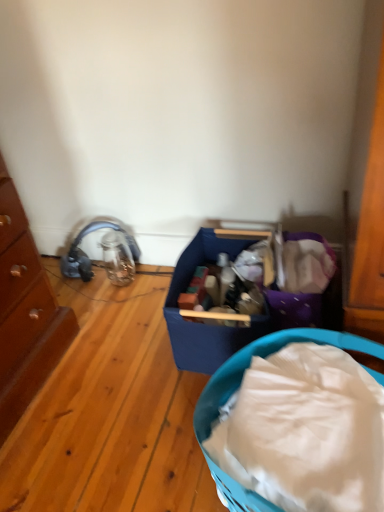
What is the approximate height of blue plastic basket at center?

blue plastic basket at center is 37.90 centimeters tall.

The width and height of the screenshot is (384, 512). Describe the element at coordinates (263, 357) in the screenshot. I see `blue plastic basket at center` at that location.

Locate an element on the screen. blue plastic basket at center is located at coordinates [263, 357].

Describe the element at coordinates (25, 313) in the screenshot. I see `wooden chest of drawers at left` at that location.

I want to click on wooden chest of drawers at left, so click(25, 313).

This screenshot has height=512, width=384. What are the coordinates of `blue plastic basket at center` in the screenshot? It's located at (263, 357).

Considering the relative positions of blue plastic basket at center and wooden chest of drawers at left in the image provided, is blue plastic basket at center to the left or to the right of wooden chest of drawers at left?

Based on their positions, blue plastic basket at center is located to the right of wooden chest of drawers at left.

Who is more distant, blue plastic basket at center or wooden chest of drawers at left?

wooden chest of drawers at left.

Which point is more distant from viewer, (x=219, y=494) or (x=11, y=276)?

The point (x=11, y=276) is farther.

From the image's perspective, between blue plastic basket at center and wooden chest of drawers at left, who is located below?

blue plastic basket at center is shown below in the image.

From a real-world perspective, which is physically below, blue plastic basket at center or wooden chest of drawers at left?

blue plastic basket at center is physically lower.

Considering the relative sizes of blue plastic basket at center and wooden chest of drawers at left in the image provided, is blue plastic basket at center thinner than wooden chest of drawers at left?

In fact, blue plastic basket at center might be wider than wooden chest of drawers at left.

Who is taller, blue plastic basket at center or wooden chest of drawers at left?

wooden chest of drawers at left is taller.

Which of these two, blue plastic basket at center or wooden chest of drawers at left, is bigger?

wooden chest of drawers at left is bigger.

Would you say blue plastic basket at center is inside or outside wooden chest of drawers at left?

The correct answer is: outside.

Looking at this image, is blue plastic basket at center far from wooden chest of drawers at left?

No.

Is blue plastic basket at center facing towards wooden chest of drawers at left?

No, blue plastic basket at center does not turn towards wooden chest of drawers at left.

From the picture: How far apart are blue plastic basket at center and wooden chest of drawers at left?

blue plastic basket at center and wooden chest of drawers at left are 25.42 inches apart.

Locate an element on the screen. The width and height of the screenshot is (384, 512). basket container below the wooden chest of drawers at left (from the image's perspective) is located at coordinates (263, 357).

Is wooden chest of drawers at left at the right side of blue plastic basket at center?

In fact, wooden chest of drawers at left is to the left of blue plastic basket at center.

Is wooden chest of drawers at left behind blue plastic basket at center?

Yes.

Between point (3, 349) and point (216, 375), which one is positioned in front?

The point (216, 375) is closer to the camera.

In the scene shown: From the image's perspective, between wooden chest of drawers at left and blue plastic basket at center, which one is located above?

wooden chest of drawers at left appears higher in the image.

From a real-world perspective, which object rests below the other?

blue plastic basket at center is physically lower.

Which of these two, wooden chest of drawers at left or blue plastic basket at center, is wider?

blue plastic basket at center is wider.

Between wooden chest of drawers at left and blue plastic basket at center, which one has more height?

wooden chest of drawers at left is taller.

In terms of size, does wooden chest of drawers at left appear bigger or smaller than blue plastic basket at center?

Considering their sizes, wooden chest of drawers at left takes up more space than blue plastic basket at center.

Is wooden chest of drawers at left outside of blue plastic basket at center?

That's correct, wooden chest of drawers at left is outside of blue plastic basket at center.

Is wooden chest of drawers at left directly adjacent to blue plastic basket at center?

No.

Is wooden chest of drawers at left oriented towards blue plastic basket at center?

Yes, wooden chest of drawers at left is oriented towards blue plastic basket at center.

How distant is wooden chest of drawers at left from blue plastic basket at center?

wooden chest of drawers at left and blue plastic basket at center are 64.55 centimeters apart.

Locate an element on the screen. Image resolution: width=384 pixels, height=512 pixels. chest of drawers above the blue plastic basket at center (from the image's perspective) is located at coordinates (25, 313).

Find the location of a particular element. The width and height of the screenshot is (384, 512). chest of drawers above the blue plastic basket at center (from the image's perspective) is located at coordinates (25, 313).

The width and height of the screenshot is (384, 512). What are the coordinates of `chest of drawers lying on the left of blue plastic basket at center` in the screenshot? It's located at (25, 313).